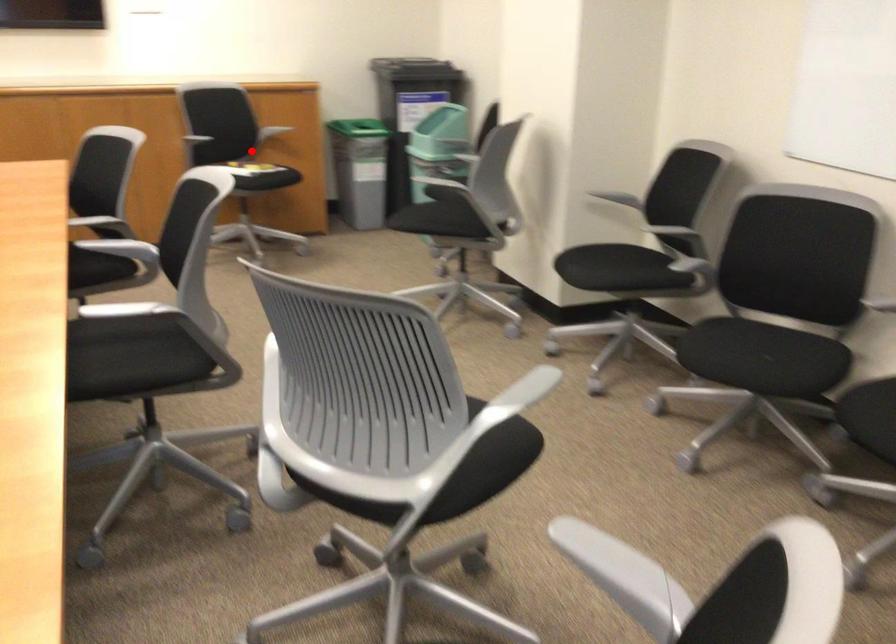
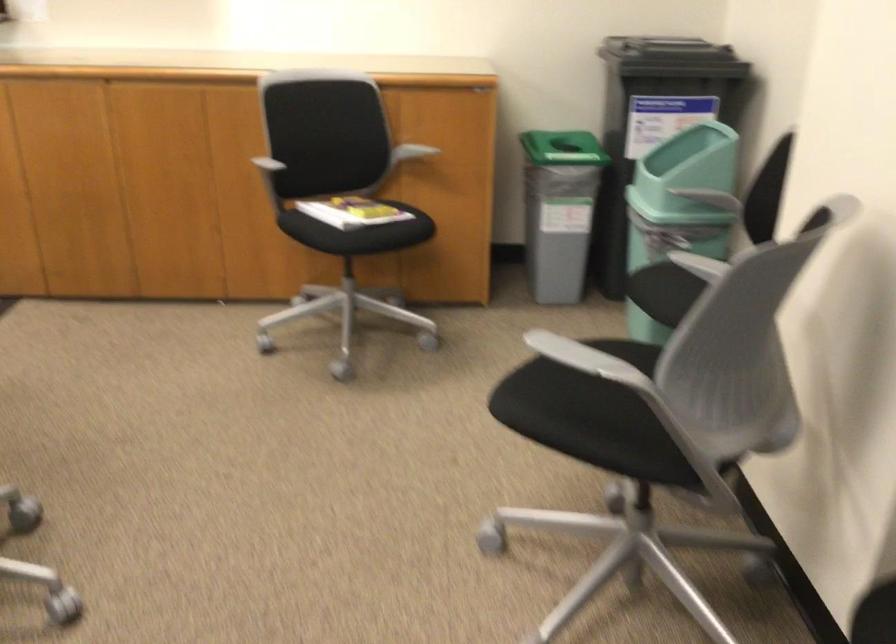
Question: A red point is marked in image1. In image2, is the corresponding 3D point closer to the camera or farther? Reply with the corresponding letter.

Choices:
 (A) The corresponding 3D point is closer.
 (B) The corresponding 3D point is farther.

Answer: (A)